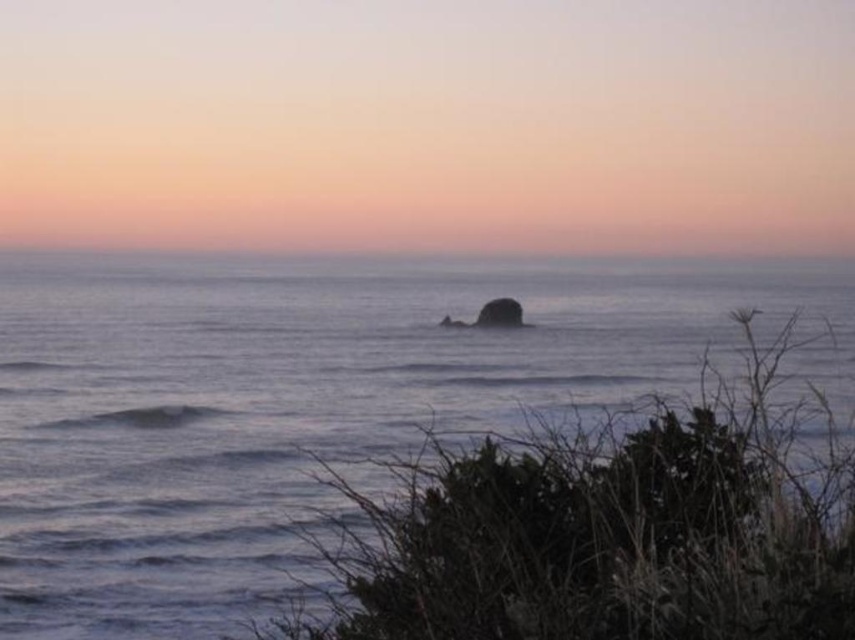
Question: Is smooth blue water at center thinner than smooth gray rock at center?

Choices:
 (A) no
 (B) yes

Answer: (A)

Question: Is smooth blue water at center positioned in front of smooth gray rock at center?

Choices:
 (A) yes
 (B) no

Answer: (A)

Question: Which point is closer to the camera taking this photo?

Choices:
 (A) (125, 625)
 (B) (514, 305)

Answer: (A)

Question: In this image, where is smooth blue water at center located relative to smooth gray rock at center?

Choices:
 (A) below
 (B) above

Answer: (B)